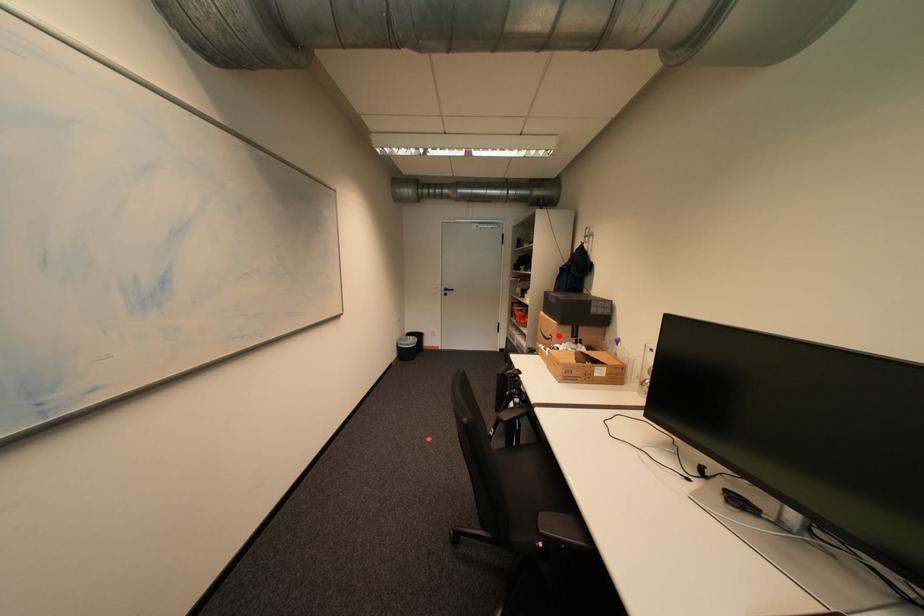
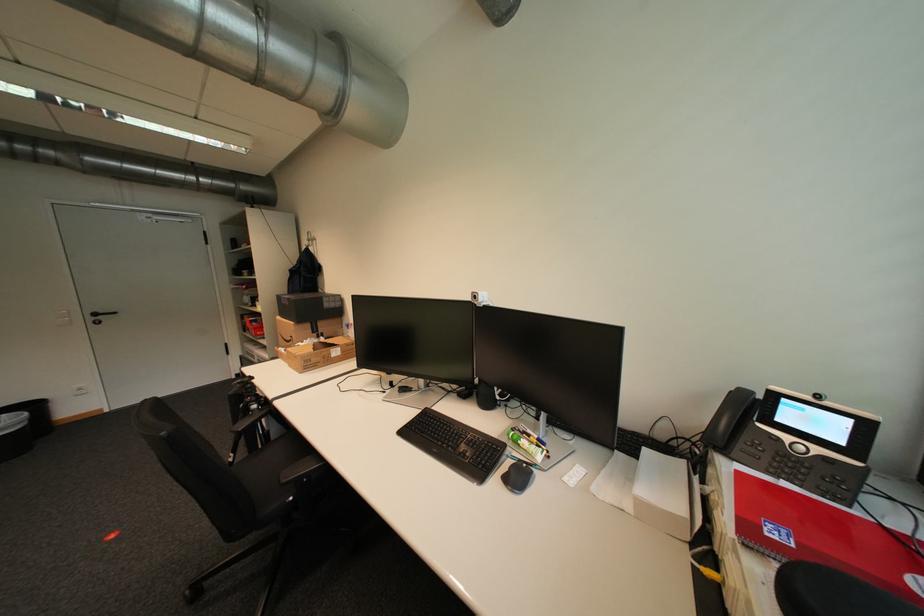
Where in the second image is the point corresponding to the highlighted location from the first image?

(299, 338)